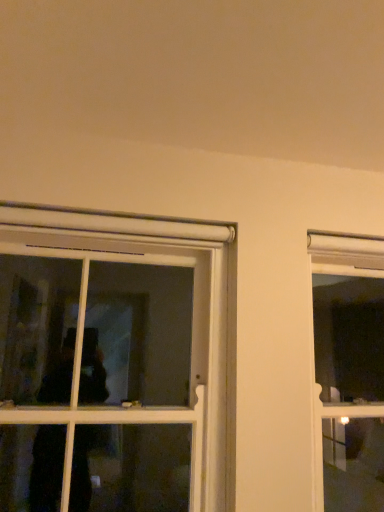
What do you see at coordinates (348, 370) in the screenshot? The width and height of the screenshot is (384, 512). I see `clear glass window at right, which is the second window from left to right` at bounding box center [348, 370].

The width and height of the screenshot is (384, 512). I want to click on clear glass window at right, which is the second window from left to right, so [348, 370].

Describe the element at coordinates (114, 362) in the screenshot. The width and height of the screenshot is (384, 512). I see `white plastic window at left, which is counted as the second window, starting from the right` at that location.

Locate an element on the screen. This screenshot has width=384, height=512. white plastic window at left, which is counted as the second window, starting from the right is located at coordinates (114, 362).

Measure the distance between point (100, 463) and camera.

Point (100, 463) and camera are 4.55 meters apart from each other.

The height and width of the screenshot is (512, 384). I want to click on clear glass window at right, which is counted as the 1th window, starting from the right, so click(x=348, y=370).

Can you confirm if white plastic window at left, the 1th window viewed from the left, is positioned to the right of clear glass window at right, which is counted as the 1th window, starting from the right?

No, white plastic window at left, the 1th window viewed from the left, is not to the right of clear glass window at right, which is counted as the 1th window, starting from the right.

Which object is closer to the camera taking this photo, white plastic window at left, the 1th window viewed from the left, or clear glass window at right, which is the second window from left to right?

white plastic window at left, the 1th window viewed from the left, is in front.

Is point (150, 293) farther from camera compared to point (368, 482)?

Yes, point (150, 293) is farther from viewer.

From the image's perspective, is white plastic window at left, the 1th window viewed from the left, beneath clear glass window at right, which is counted as the 1th window, starting from the right?

No, from the image's perspective, white plastic window at left, the 1th window viewed from the left, is not below clear glass window at right, which is counted as the 1th window, starting from the right.

From a real-world perspective, relative to clear glass window at right, which is counted as the 1th window, starting from the right, is white plastic window at left, which is counted as the second window, starting from the right, vertically above or below?

white plastic window at left, which is counted as the second window, starting from the right, is above clear glass window at right, which is counted as the 1th window, starting from the right.

Looking at this image, is white plastic window at left, which is counted as the second window, starting from the right, thinner than clear glass window at right, which is the second window from left to right?

Yes.

Is white plastic window at left, which is counted as the second window, starting from the right, shorter than clear glass window at right, which is the second window from left to right?

Correct, white plastic window at left, which is counted as the second window, starting from the right, is not as tall as clear glass window at right, which is the second window from left to right.

Based on their sizes in the image, would you say white plastic window at left, which is counted as the second window, starting from the right, is bigger or smaller than clear glass window at right, which is the second window from left to right?

Considering their sizes, white plastic window at left, which is counted as the second window, starting from the right, takes up more space than clear glass window at right, which is the second window from left to right.

Would you say white plastic window at left, which is counted as the second window, starting from the right, is outside clear glass window at right, which is counted as the 1th window, starting from the right?

Absolutely, white plastic window at left, which is counted as the second window, starting from the right, is external to clear glass window at right, which is counted as the 1th window, starting from the right.

Is white plastic window at left, the 1th window viewed from the left, placed right next to clear glass window at right, which is the second window from left to right?

They are not placed beside each other.

Is white plastic window at left, the 1th window viewed from the left, facing away from clear glass window at right, which is counted as the 1th window, starting from the right?

No, clear glass window at right, which is counted as the 1th window, starting from the right, is not at the back of white plastic window at left, the 1th window viewed from the left.

Can you tell me how much white plastic window at left, which is counted as the second window, starting from the right, and clear glass window at right, which is the second window from left to right, differ in facing direction?

0.962 degrees.

Based on the photo, measure the distance between white plastic window at left, which is counted as the second window, starting from the right, and clear glass window at right, which is the second window from left to right.

8.44 feet.

This screenshot has height=512, width=384. I want to click on window below the white plastic window at left, the 1th window viewed from the left (from the image's perspective), so click(x=348, y=370).

Is clear glass window at right, which is the second window from left to right, to the left or to the right of white plastic window at left, the 1th window viewed from the left, in the image?

Based on their positions, clear glass window at right, which is the second window from left to right, is located to the right of white plastic window at left, the 1th window viewed from the left.

Which is in front, clear glass window at right, which is counted as the 1th window, starting from the right, or white plastic window at left, which is counted as the second window, starting from the right?

white plastic window at left, which is counted as the second window, starting from the right.

Is point (326, 448) positioned behind point (55, 297)?

Yes, point (326, 448) is farther from viewer.

From the image's perspective, which is above, clear glass window at right, which is counted as the 1th window, starting from the right, or white plastic window at left, the 1th window viewed from the left?

white plastic window at left, the 1th window viewed from the left.

From a real-world perspective, is clear glass window at right, which is counted as the 1th window, starting from the right, below white plastic window at left, the 1th window viewed from the left?

Indeed, from a real-world perspective, clear glass window at right, which is counted as the 1th window, starting from the right, is positioned beneath white plastic window at left, the 1th window viewed from the left.

Is clear glass window at right, which is the second window from left to right, wider or thinner than white plastic window at left, which is counted as the second window, starting from the right?

Clearly, clear glass window at right, which is the second window from left to right, has more width compared to white plastic window at left, which is counted as the second window, starting from the right.

Does clear glass window at right, which is counted as the 1th window, starting from the right, have a lesser height compared to white plastic window at left, which is counted as the second window, starting from the right?

In fact, clear glass window at right, which is counted as the 1th window, starting from the right, may be taller than white plastic window at left, which is counted as the second window, starting from the right.

Who is smaller, clear glass window at right, which is counted as the 1th window, starting from the right, or white plastic window at left, the 1th window viewed from the left?

clear glass window at right, which is counted as the 1th window, starting from the right, is smaller.

Is clear glass window at right, which is counted as the 1th window, starting from the right, inside or outside of white plastic window at left, the 1th window viewed from the left?

clear glass window at right, which is counted as the 1th window, starting from the right, cannot be found inside white plastic window at left, the 1th window viewed from the left.

Is clear glass window at right, which is the second window from left to right, touching white plastic window at left, which is counted as the second window, starting from the right?

No, clear glass window at right, which is the second window from left to right, is not in contact with white plastic window at left, which is counted as the second window, starting from the right.

Could you tell me if clear glass window at right, which is the second window from left to right, is turned towards white plastic window at left, the 1th window viewed from the left?

No.

How different are the orientations of clear glass window at right, which is the second window from left to right, and white plastic window at left, which is counted as the second window, starting from the right, in degrees?

0.962 degrees.

I want to click on window on the left of clear glass window at right, which is counted as the 1th window, starting from the right, so click(114, 362).

The width and height of the screenshot is (384, 512). In order to click on window lying behind the white plastic window at left, which is counted as the second window, starting from the right in this screenshot , I will do `click(348, 370)`.

Identify the location of window on the left of clear glass window at right, which is the second window from left to right. pyautogui.click(x=114, y=362).